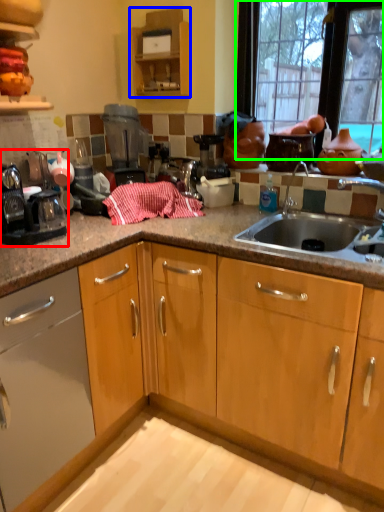
Question: Estimate the real-world distances between objects in this image. Which object is farther from appliance (highlighted by a red box), cabinetry (highlighted by a blue box) or window (highlighted by a green box)?

Choices:
 (A) cabinetry
 (B) window

Answer: (B)